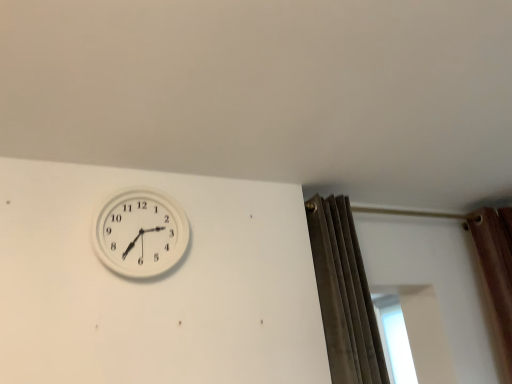
Question: Is velvet gray curtain at right wider or thinner than white plastic wall clock at upper left?

Choices:
 (A) thin
 (B) wide

Answer: (B)

Question: From a real-world perspective, is velvet gray curtain at right positioned above or below white plastic wall clock at upper left?

Choices:
 (A) below
 (B) above

Answer: (A)

Question: Considering the relative positions of velvet gray curtain at right and white plastic wall clock at upper left in the image provided, is velvet gray curtain at right to the left or to the right of white plastic wall clock at upper left?

Choices:
 (A) left
 (B) right

Answer: (B)

Question: Is white plastic wall clock at upper left taller or shorter than velvet gray curtain at right?

Choices:
 (A) tall
 (B) short

Answer: (B)

Question: From the image's perspective, is white plastic wall clock at upper left positioned above or below velvet gray curtain at right?

Choices:
 (A) below
 (B) above

Answer: (B)

Question: In the image, is white plastic wall clock at upper left positioned in front of or behind velvet gray curtain at right?

Choices:
 (A) behind
 (B) front

Answer: (B)

Question: In terms of width, does white plastic wall clock at upper left look wider or thinner when compared to velvet gray curtain at right?

Choices:
 (A) thin
 (B) wide

Answer: (A)